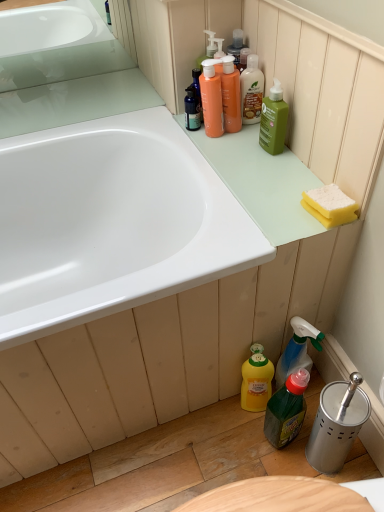
You are a GUI agent. You are given a task and a screenshot of the screen. Output one action in this format:
    pyautogui.click(x=<x>, y=<y>)
    Task: Click on the vacant space in between matte orange pump bottles at upper center, which is the second cleaning product from top to bottom, and green matte bottle at upper right, which appears as the 3th cleaning product when viewed from the top
    The height and width of the screenshot is (512, 384).
    Given the screenshot: What is the action you would take?
    pyautogui.click(x=245, y=138)